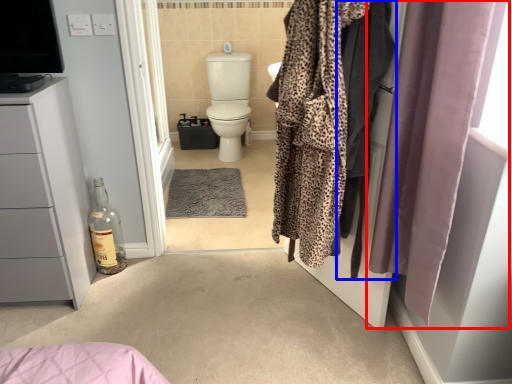
Question: Which object appears closest to the camera in this image, curtain (highlighted by a red box) or clothing (highlighted by a blue box)?

Choices:
 (A) curtain
 (B) clothing

Answer: (A)